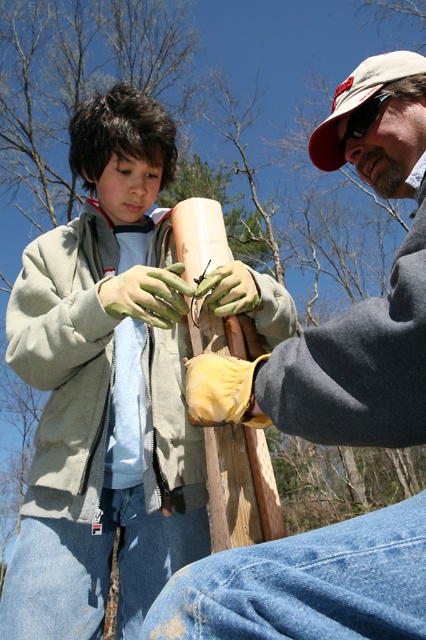
Does matte green jacket at center have a greater height compared to matte gray jacket at center?

Correct, matte green jacket at center is much taller as matte gray jacket at center.

Locate an element on the screen. The height and width of the screenshot is (640, 426). matte green jacket at center is located at coordinates (114, 385).

Where is `matte green jacket at center`? The height and width of the screenshot is (640, 426). matte green jacket at center is located at coordinates (114, 385).

Between point (60, 522) and point (380, 77), which one is positioned in front?

Point (60, 522) is in front.

Can you confirm if matte green jacket at center is taller than white fabric baseball cap at upper right?

Yes.

Who is more forward, (x=86, y=602) or (x=360, y=97)?

Point (x=86, y=602)

Locate an element on the screen. The width and height of the screenshot is (426, 640). matte green jacket at center is located at coordinates (114, 385).

Does matte gray jacket at center lie in front of white fabric baseball cap at upper right?

That is True.

Consider the image. Does matte gray jacket at center come behind white fabric baseball cap at upper right?

No, it is in front of white fabric baseball cap at upper right.

Which is behind, point (219, 385) or point (359, 93)?

Point (359, 93)

The image size is (426, 640). Find the location of `matte gray jacket at center`. matte gray jacket at center is located at coordinates [x=356, y=305].